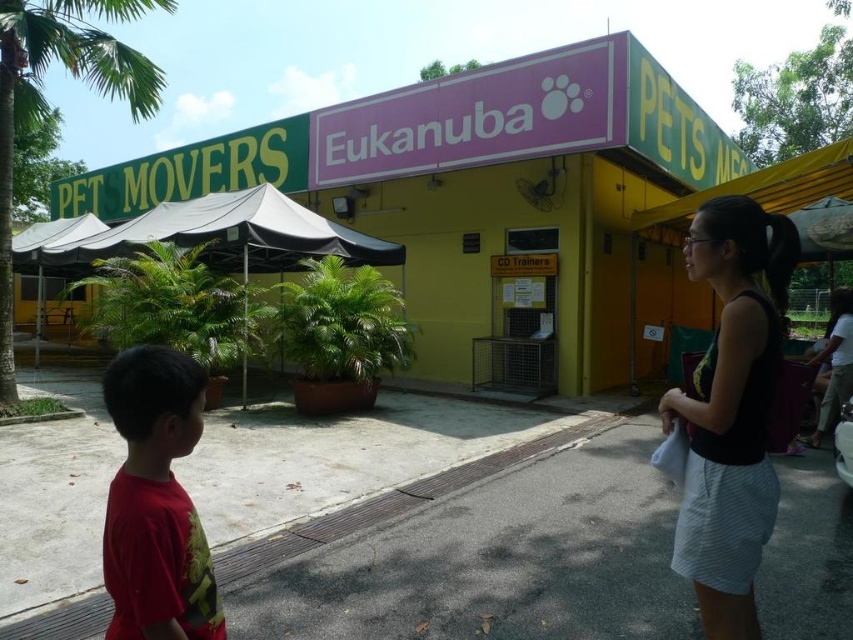
You are a customer approaching the PET MOVERS building and need to locate the pink matte sign at center. Which direction should you look relative to the green leafy palm tree at upper left?

The pink matte sign at center is positioned on the right side of green leafy palm tree at upper left, so you should look to the right of the green leafy palm tree at upper left to find it.